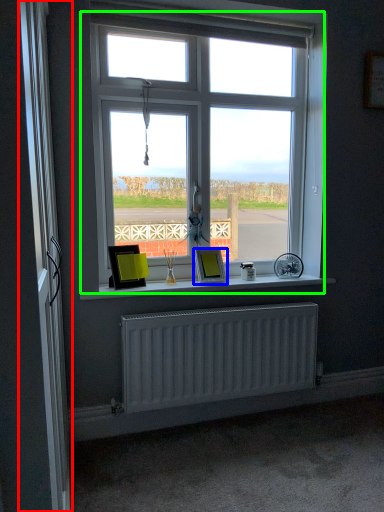
Question: Which object is positioned farthest from screen door (highlighted by a red box)? Select from picture frame (highlighted by a blue box) and window (highlighted by a green box).

Choices:
 (A) picture frame
 (B) window

Answer: (B)